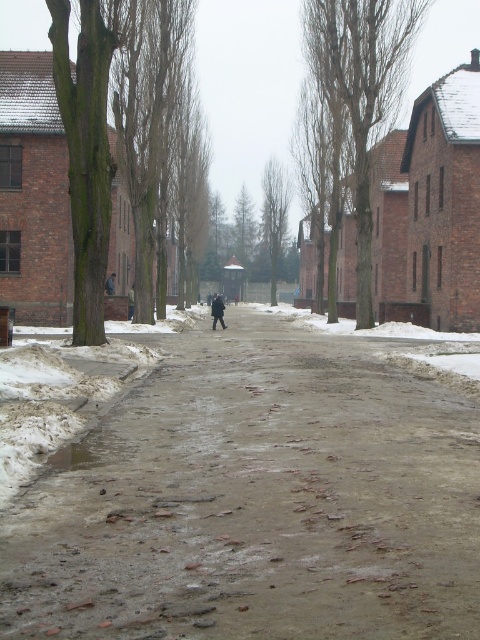
Question: Does dull concrete pavement at center have a smaller size compared to dark gray wool coat at center?

Choices:
 (A) no
 (B) yes

Answer: (A)

Question: Where is dull concrete pavement at center located in relation to dark gray wool coat at center in the image?

Choices:
 (A) above
 (B) below

Answer: (B)

Question: Considering the relative positions of dull concrete pavement at center and dark gray wool coat at center in the image provided, where is dull concrete pavement at center located with respect to dark gray wool coat at center?

Choices:
 (A) above
 (B) below

Answer: (B)

Question: Which object appears closest to the camera in this image?

Choices:
 (A) dark gray wool coat at center
 (B) dull concrete pavement at center

Answer: (B)

Question: Which point is farther to the camera?

Choices:
 (A) (217, 305)
 (B) (276, 593)

Answer: (A)

Question: Which object appears closest to the camera in this image?

Choices:
 (A) dark gray wool coat at center
 (B) dull concrete pavement at center

Answer: (B)